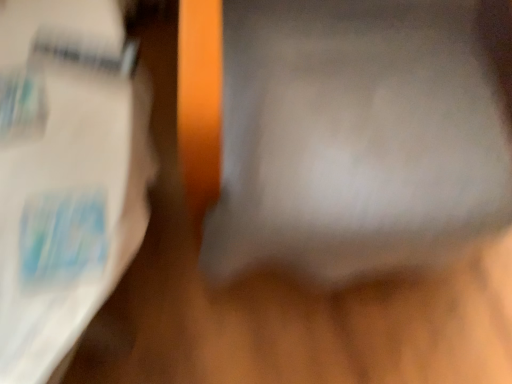
Question: Should I look upward or downward to see white paper at upper left?

Choices:
 (A) up
 (B) down

Answer: (A)